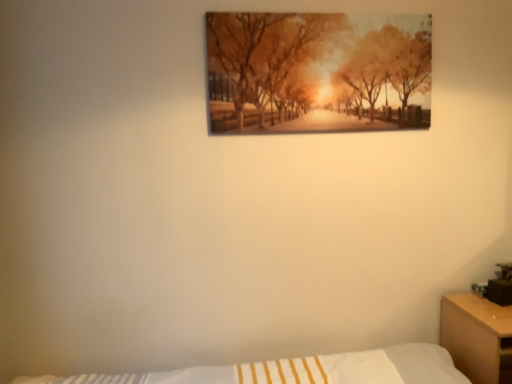
Find the location of a particular element. This screenshot has width=512, height=384. free spot to the left of matte black table lamp at right is located at coordinates (472, 298).